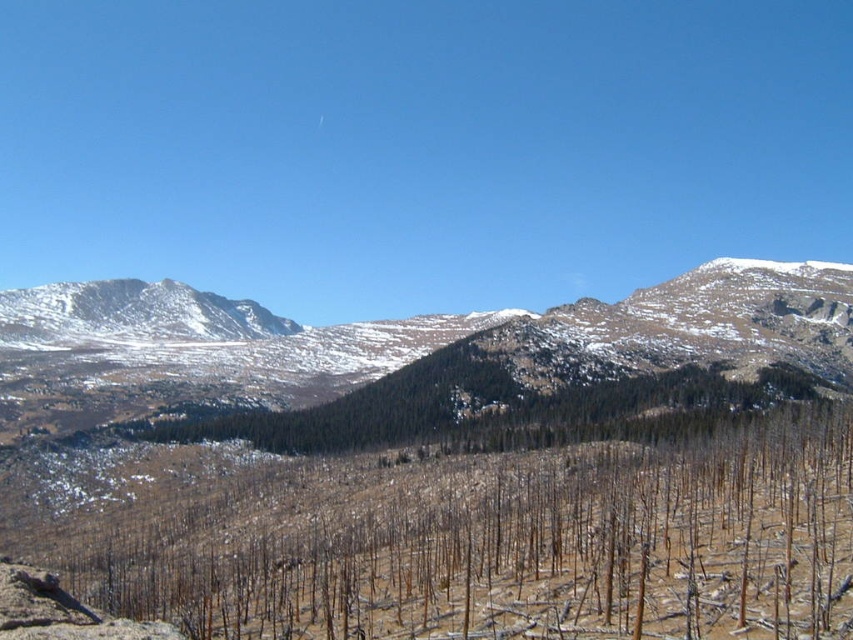
Question: Does snowy rocky mountain at center have a lesser width compared to snowy rocky mountain at left?

Choices:
 (A) no
 (B) yes

Answer: (A)

Question: Is snowy rocky mountain at center in front of snowy rocky mountain at left?

Choices:
 (A) yes
 (B) no

Answer: (A)

Question: Does snowy rocky mountain at center have a greater width compared to snowy rocky mountain at left?

Choices:
 (A) yes
 (B) no

Answer: (A)

Question: Which point is closer to the camera taking this photo?

Choices:
 (A) (42, 317)
 (B) (440, 340)

Answer: (B)